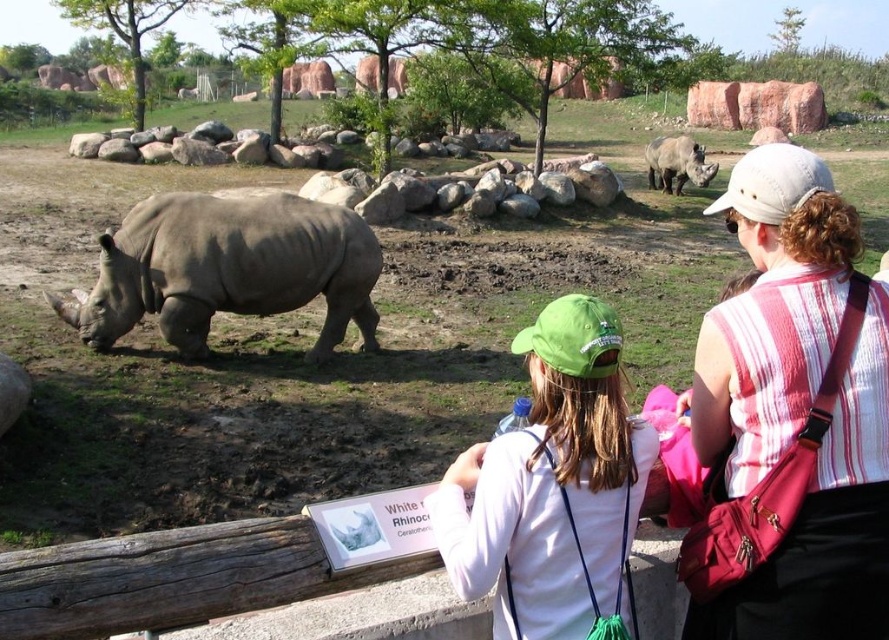
Question: Is green fabric cap at center to the left of gray matte rhinoceros at left from the viewer's perspective?

Choices:
 (A) no
 (B) yes

Answer: (A)

Question: Which of the following is the farthest from the observer?

Choices:
 (A) striped cotton tank top at upper right
 (B) gray matte rhinoceros at center
 (C) green fabric cap at center

Answer: (B)

Question: Which is nearer to the gray matte rhinoceros at center?

Choices:
 (A) striped cotton tank top at upper right
 (B) gray matte rhinoceros at left

Answer: (B)

Question: Which object is positioned farthest from the striped cotton tank top at upper right?

Choices:
 (A) green fabric cap at center
 (B) gray matte rhinoceros at left

Answer: (B)

Question: Can you confirm if green fabric cap at center is thinner than gray matte rhinoceros at center?

Choices:
 (A) no
 (B) yes

Answer: (B)

Question: Is striped cotton tank top at upper right below gray matte rhinoceros at left?

Choices:
 (A) yes
 (B) no

Answer: (A)